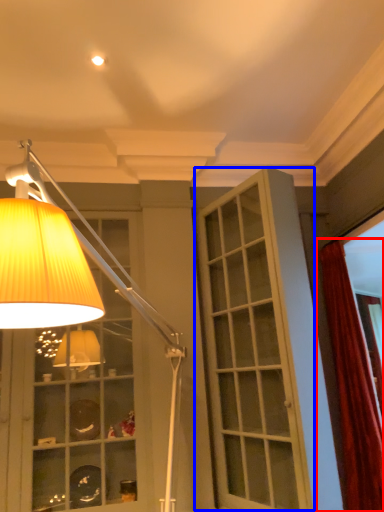
Question: Among these objects, which one is nearest to the camera, curtain (highlighted by a red box) or screen door (highlighted by a blue box)?

Choices:
 (A) curtain
 (B) screen door

Answer: (B)